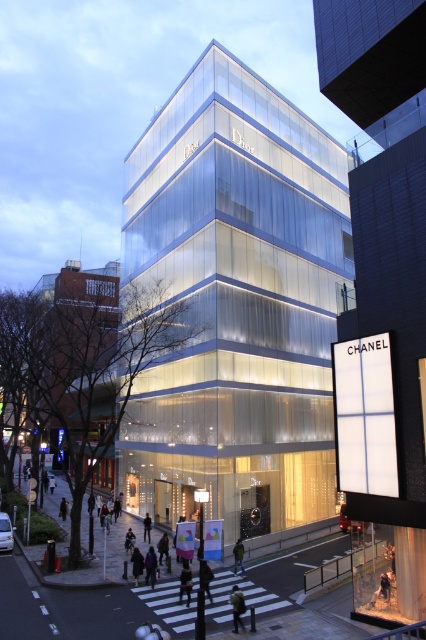
What is the color of the fabric at the point labeled as point [186,580]?

The point [186,580] is on dark gray fabric at lower center.

You are a customer standing in front of the Dior building and want to touch the dark gray fabric at lower center and the dark blue jacket at lower center. Which one is closer to your right hand?

The dark gray fabric at lower center is to the right of dark blue jacket at lower center, so the dark gray fabric at lower center is closer to your right hand.